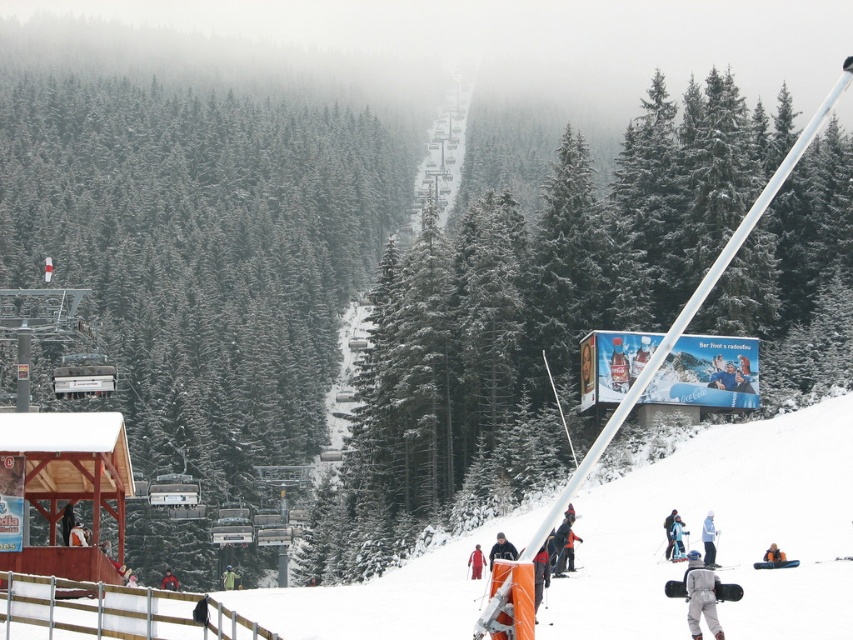
You are standing at the base of the mountain looking up at the ski resort scene. There are two points marked in the image. The first point is at coordinates point (711,264) and the second is at point (221,573). Which point is closer to you?

Point (711,264) is closer to the viewer than point (221,573).

You are a photographer standing at the bottom of the slope. You want to take a photo that includes both the gray fabric snowsuit at lower right and the green fabric jacket at center. Which one should you adjust your camera angle to focus on first to ensure both are in frame?

The gray fabric snowsuit at lower right is located above the green fabric jacket at center, so you should focus on the gray fabric snowsuit at lower right first to ensure both are in frame.